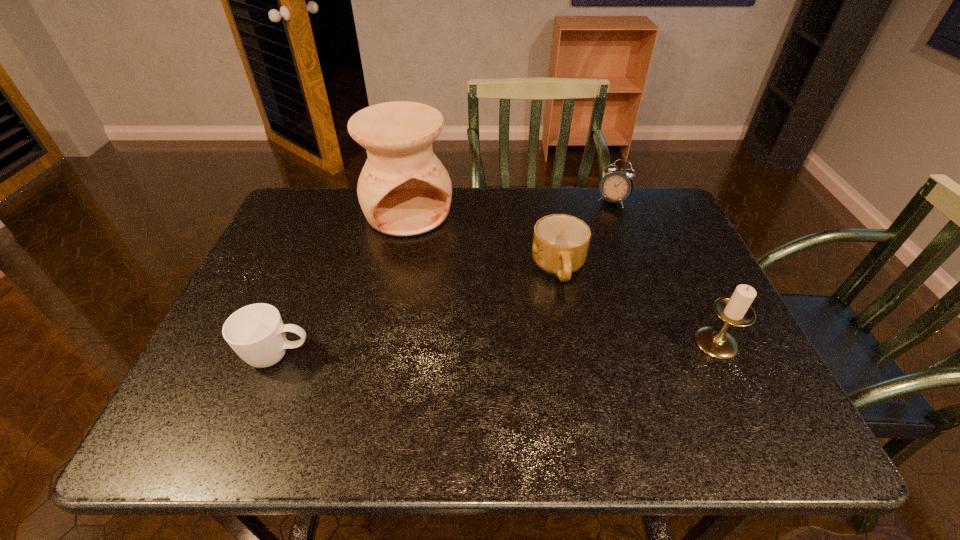
This screenshot has width=960, height=540. I want to click on object that is the second nearest to the pottery, so click(256, 333).

Locate which object is the second closest to the third farthest object. Please provide its 2D coordinates. Your answer should be formatted as a tuple, i.e. [(x, y)], where the tuple contains the x and y coordinates of a point satisfying the conditions above.

[(404, 190)]